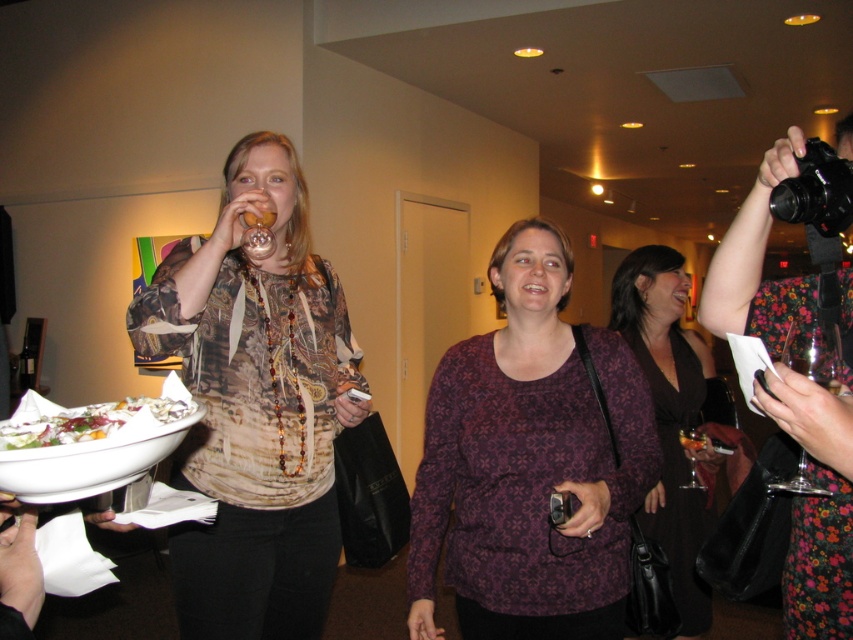
Consider the image. Does purple printed dress at center appear on the right side of white glossy salad bowl at lower left?

Yes, purple printed dress at center is to the right of white glossy salad bowl at lower left.

Where is `purple printed dress at center`? purple printed dress at center is located at coordinates (669, 413).

Who is more distant from viewer, [703,502] or [112,410]?

The point [703,502] is behind.

Where is `purple printed dress at center`? purple printed dress at center is located at coordinates (669, 413).

Does printed silk blouse at left have a smaller size compared to white ceramic platter at lower left?

No, printed silk blouse at left is not smaller than white ceramic platter at lower left.

Is the position of printed silk blouse at left more distant than that of white ceramic platter at lower left?

Yes, printed silk blouse at left is behind white ceramic platter at lower left.

Between point (258, 593) and point (115, 440), which one is positioned behind?

Positioned behind is point (258, 593).

Identify the location of printed silk blouse at left. (256, 404).

Between printed silk blouse at left and purple printed shirt at center, which one is positioned lower?

purple printed shirt at center is lower down.

Can you confirm if printed silk blouse at left is wider than purple printed shirt at center?

No, printed silk blouse at left is not wider than purple printed shirt at center.

The width and height of the screenshot is (853, 640). Identify the location of printed silk blouse at left. click(256, 404).